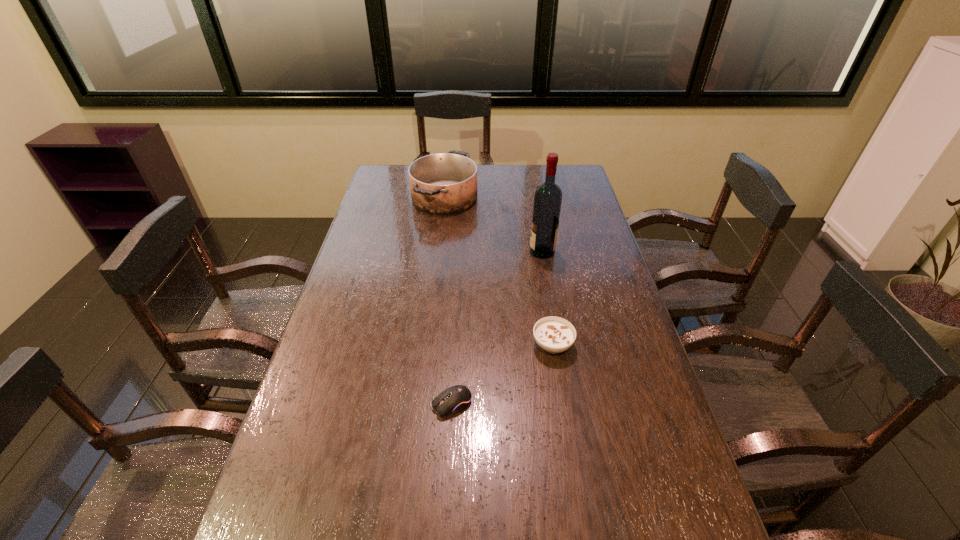
The image size is (960, 540). Identify the location of empty location between the tallest object and the farthest object. (493, 225).

Locate an element on the screen. The image size is (960, 540). free space between the third shortest object and the computer mouse is located at coordinates (448, 300).

You are a GUI agent. You are given a task and a screenshot of the screen. Output one action in this format:
    pyautogui.click(x=<x>, y=<y>)
    Task: Click on the empty space that is in between the alcohol and the third tallest object
    
    Given the screenshot: What is the action you would take?
    pyautogui.click(x=547, y=298)

This screenshot has height=540, width=960. Identify the location of free spot between the soup bowl and the tallest object. (547, 298).

This screenshot has width=960, height=540. I want to click on free area in between the computer mouse and the saucepan, so click(x=448, y=300).

Image resolution: width=960 pixels, height=540 pixels. Find the location of `free point between the second tallest object and the third tallest object`. free point between the second tallest object and the third tallest object is located at coordinates (498, 271).

Find the location of a particular element. Image resolution: width=960 pixels, height=540 pixels. free spot between the shortest object and the third shortest object is located at coordinates (448, 300).

Where is `vacant space that's between the computer mouse and the third farthest object`? The image size is (960, 540). vacant space that's between the computer mouse and the third farthest object is located at coordinates (502, 374).

I want to click on empty space between the farthest object and the computer mouse, so click(x=448, y=300).

This screenshot has height=540, width=960. I want to click on blank region between the shortest object and the third shortest object, so click(448, 300).